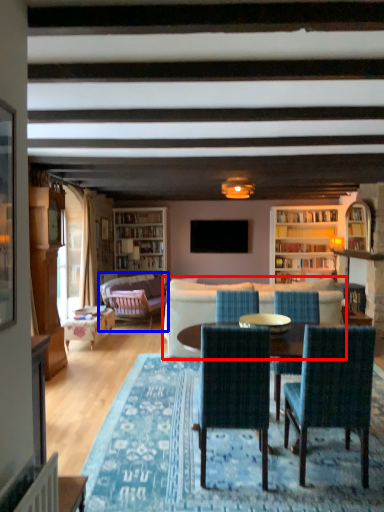
Question: Which of the following is the closest to the observer, studio couch (highlighted by a red box) or studio couch (highlighted by a blue box)?

Choices:
 (A) studio couch
 (B) studio couch

Answer: (A)